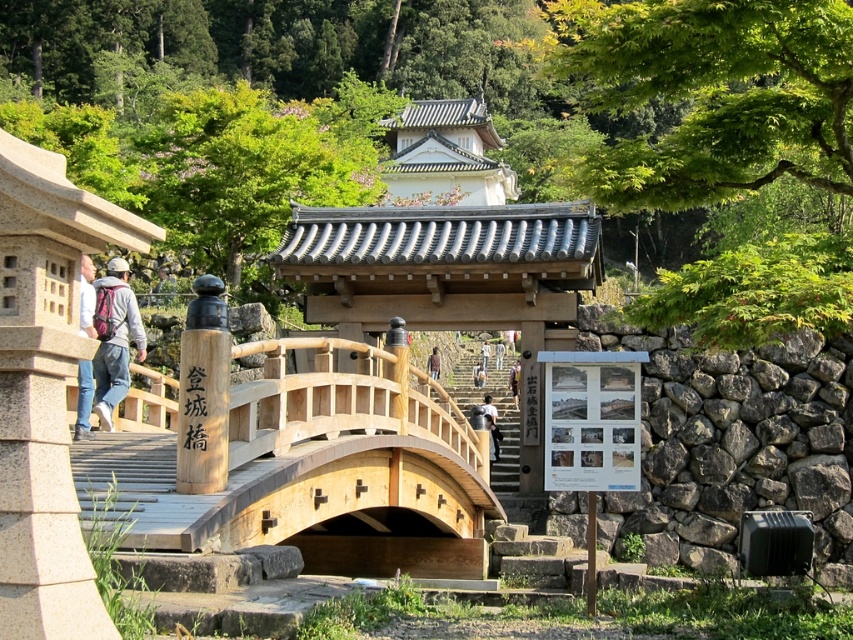
You are a tourist visiting this traditional Japanese site and want to take a photo of both the natural wood bridge at center and the denim jacket at left. Your camera has a maximum focus range of 6 meters. Can you capture both objects in a single photo without moving your position?

The natural wood bridge at center and denim jacket at left are 6.72 meters apart. Since the distance between them exceeds your camera maximum focus range of 6 meters, you cannot capture both in a single photo without moving your position.

You are a traveler standing on the wooden bridge in the scene. You notice a gray fleece jacket at left and dark blue jeans at center. Which item is wider?

The gray fleece jacket at left is wider than the dark blue jeans at center.

You are a traveler who just arrived at this traditional Japanese site. You see a gray fleece jacket at left and dark blue jeans at center. Which item of clothing is larger in size?

The gray fleece jacket at left is bigger than the dark blue jeans at center.